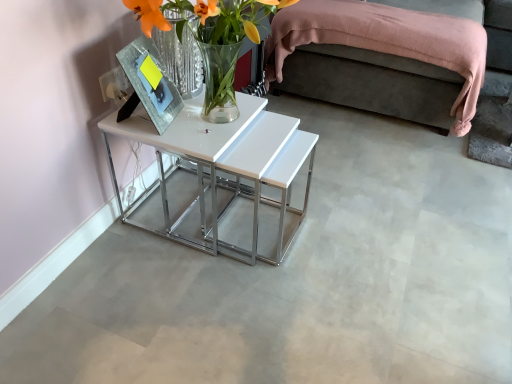
Describe the element at coordinates (379, 60) in the screenshot. This screenshot has height=384, width=512. I see `pink fabric bed at upper right` at that location.

Identify the location of pink fabric bed at upper right. (379, 60).

Does white glossy table at center appear on the left side of translucent glass vase at center?

Indeed, white glossy table at center is positioned on the left side of translucent glass vase at center.

Considering the relative sizes of white glossy table at center and translucent glass vase at center in the image provided, is white glossy table at center wider than translucent glass vase at center?

Indeed, white glossy table at center has a greater width compared to translucent glass vase at center.

Can you confirm if white glossy table at center is smaller than translucent glass vase at center?

No, white glossy table at center is not smaller than translucent glass vase at center.

From a real-world perspective, is white glossy table at center positioned above or below translucent glass vase at center?

white glossy table at center is below translucent glass vase at center.

From the picture: From a real-world perspective, is translucent glass vase at center physically located above or below white glossy table at center?

translucent glass vase at center is situated higher than white glossy table at center in the real world.

In the scene shown: Is translucent glass vase at center facing away from white glossy table at center?

No, white glossy table at center is not at the back of translucent glass vase at center.

Is translucent glass vase at center positioned far away from white glossy table at center?

Actually, translucent glass vase at center and white glossy table at center are a little close together.

Which object is positioned more to the right, translucent glass vase at center or white glossy table at center?

translucent glass vase at center.

From the image's perspective, between white glossy table at center and pink fabric bed at upper right, who is located below?

white glossy table at center.

Based on the photo, is white glossy table at center to the left or to the right of pink fabric bed at upper right in the image?

In the image, white glossy table at center appears on the left side of pink fabric bed at upper right.

Is white glossy table at center not near pink fabric bed at upper right?

No, white glossy table at center is not far from pink fabric bed at upper right.

What's the angular difference between translucent glass vase at center and pink fabric bed at upper right's facing directions?

The facing directions of translucent glass vase at center and pink fabric bed at upper right are 90.2 degrees apart.

Is translucent glass vase at center taller than pink fabric bed at upper right?

No.

Does point (210, 109) lie in front of point (320, 34)?

Yes, it is in front of point (320, 34).

Does point (275, 31) lie in front of point (165, 186)?

No, (275, 31) is behind (165, 186).

Considering the sizes of objects pink fabric bed at upper right and white glossy table at center in the image provided, who is taller, pink fabric bed at upper right or white glossy table at center?

Standing taller between the two is pink fabric bed at upper right.

Is pink fabric bed at upper right looking in the opposite direction of white glossy table at center?

No, pink fabric bed at upper right's orientation is not away from white glossy table at center.

How distant is pink fabric bed at upper right from translucent glass vase at center?

38.88 inches.

Is pink fabric bed at upper right turned away from translucent glass vase at center?

pink fabric bed at upper right is not turned away from translucent glass vase at center.

Where is `floral arrangement in front of the pink fabric bed at upper right`? Image resolution: width=512 pixels, height=384 pixels. floral arrangement in front of the pink fabric bed at upper right is located at coordinates (208, 18).

Which object is further away from the camera taking this photo, pink fabric bed at upper right or translucent glass vase at center?

Positioned behind is pink fabric bed at upper right.

The image size is (512, 384). I want to click on table directly beneath the translucent glass vase at center (from a real-world perspective), so click(x=226, y=166).

Where is `floral arrangement that is in front of the white glossy table at center`? The image size is (512, 384). floral arrangement that is in front of the white glossy table at center is located at coordinates (208, 18).

When comparing their distances from translucent glass vase at center, does white glossy table at center or pink fabric bed at upper right seem further?

Among the two, pink fabric bed at upper right is located further to translucent glass vase at center.

Which object lies nearer to the anchor point pink fabric bed at upper right, translucent glass vase at center or white glossy table at center?

white glossy table at center lies closer to pink fabric bed at upper right than the other object.

Based on their spatial positions, is pink fabric bed at upper right or translucent glass vase at center closer to white glossy table at center?

translucent glass vase at center lies closer to white glossy table at center than the other object.

Which object lies nearer to the anchor point translucent glass vase at center, pink fabric bed at upper right or white glossy table at center?

Based on the image, white glossy table at center appears to be nearer to translucent glass vase at center.

From the image, which object appears to be nearer to white glossy table at center, translucent glass vase at center or pink fabric bed at upper right?

translucent glass vase at center.

Based on their spatial positions, is white glossy table at center or translucent glass vase at center further from pink fabric bed at upper right?

translucent glass vase at center is further to pink fabric bed at upper right.

Where is `table located between translucent glass vase at center and pink fabric bed at upper right in the depth direction`? table located between translucent glass vase at center and pink fabric bed at upper right in the depth direction is located at coordinates (226, 166).